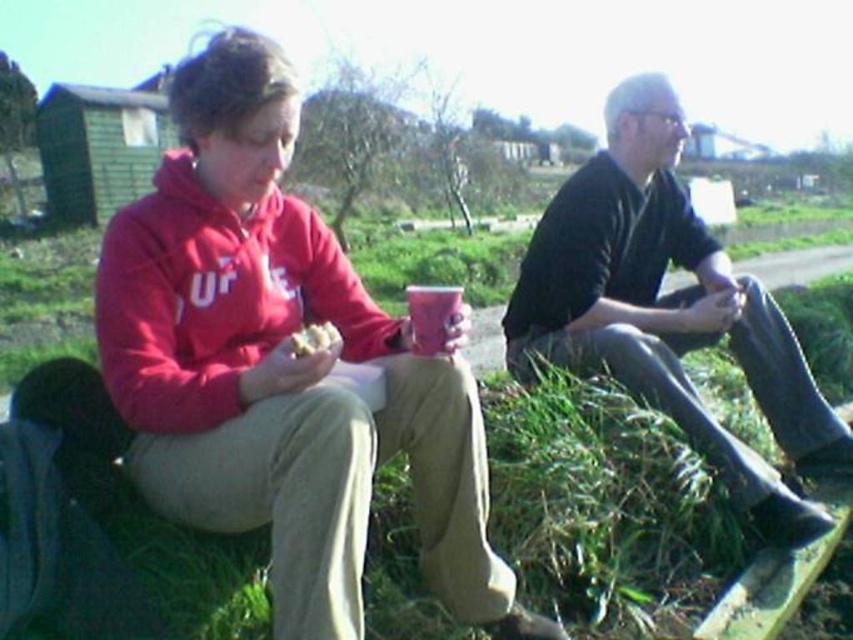
Does matte plastic cup at center appear on the left side of crumbly bread at center?

No, matte plastic cup at center is not to the left of crumbly bread at center.

Between matte plastic cup at center and crumbly bread at center, which one is positioned lower?

crumbly bread at center is lower down.

Is point (428, 285) more distant than point (328, 326)?

That is True.

At what (x,y) coordinates should I click in order to perform the action: click on matte plastic cup at center. Please return your answer as a coordinate pair (x, y). The image size is (853, 640). Looking at the image, I should click on (431, 316).

Locate an element on the screen. The image size is (853, 640). rubber boots at right is located at coordinates (666, 308).

Can you confirm if rubber boots at right is positioned below crumbly bread at center?

Yes.

Who is more forward, (614, 268) or (326, 323)?

Point (326, 323)

Locate an element on the screen. Image resolution: width=853 pixels, height=640 pixels. rubber boots at right is located at coordinates (666, 308).

Between point (521, 362) and point (440, 330), which one is positioned behind?

The point (521, 362) is behind.

This screenshot has width=853, height=640. Identify the location of rubber boots at right. (666, 308).

At what (x,y) coordinates should I click in order to perform the action: click on rubber boots at right. Please return your answer as a coordinate pair (x, y). This screenshot has width=853, height=640. Looking at the image, I should click on (666, 308).